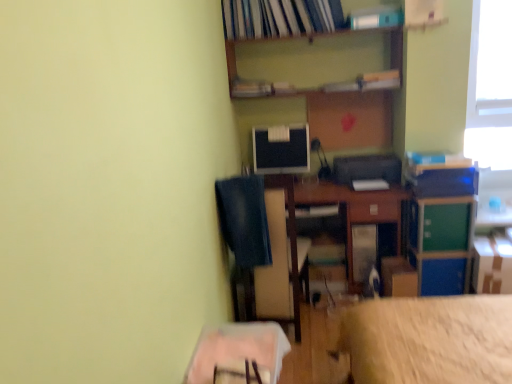
Question: Is white plastic book at upper center, which appears as the second book when ordered from the bottom, located outside wooden table at lower center, which is the 2th table in right-to-left order?

Choices:
 (A) yes
 (B) no

Answer: (A)

Question: From a real-world perspective, is white plastic book at upper center, marked as the second book in a top-to-bottom arrangement, located higher than wooden table at lower center, arranged as the first table when viewed from the front?

Choices:
 (A) no
 (B) yes

Answer: (B)

Question: Is white plastic book at upper center, marked as the second book in a top-to-bottom arrangement, wider than wooden table at lower center, which is the second table in back-to-front order?

Choices:
 (A) no
 (B) yes

Answer: (A)

Question: Considering the relative sizes of white plastic book at upper center, marked as the second book in a top-to-bottom arrangement, and wooden table at lower center, which is the 2th table in right-to-left order, in the image provided, is white plastic book at upper center, marked as the second book in a top-to-bottom arrangement, bigger than wooden table at lower center, which is the 2th table in right-to-left order,?

Choices:
 (A) yes
 (B) no

Answer: (B)

Question: Is white plastic book at upper center, which appears as the second book when ordered from the bottom, at the right side of wooden table at lower center, which is the second table in back-to-front order?

Choices:
 (A) no
 (B) yes

Answer: (B)

Question: Is white plastic book at upper center, which appears as the second book when ordered from the bottom, in front of or behind green plastic file cabinet at right in the image?

Choices:
 (A) behind
 (B) front

Answer: (A)

Question: From the image's perspective, relative to green plastic file cabinet at right, is white plastic book at upper center, which appears as the second book when ordered from the bottom, above or below?

Choices:
 (A) above
 (B) below

Answer: (A)

Question: Considering the relative positions of white plastic book at upper center, which appears as the second book when ordered from the bottom, and green plastic file cabinet at right in the image provided, is white plastic book at upper center, which appears as the second book when ordered from the bottom, to the left or to the right of green plastic file cabinet at right?

Choices:
 (A) right
 (B) left

Answer: (B)

Question: In terms of height, does white plastic book at upper center, which appears as the second book when ordered from the bottom, look taller or shorter compared to green plastic file cabinet at right?

Choices:
 (A) short
 (B) tall

Answer: (A)

Question: Does point (271, 139) appear closer or farther from the camera than point (280, 92)?

Choices:
 (A) closer
 (B) farther

Answer: (B)

Question: From the image's perspective, is matte black monitor at center above or below matte plastic book at upper center, which appears as the third book when viewed from the top?

Choices:
 (A) below
 (B) above

Answer: (A)

Question: Considering the positions of matte black monitor at center and matte plastic book at upper center, which appears as the third book when viewed from the top, in the image, is matte black monitor at center bigger or smaller than matte plastic book at upper center, which appears as the third book when viewed from the top,?

Choices:
 (A) small
 (B) big

Answer: (B)

Question: Looking at their shapes, would you say matte black monitor at center is wider or thinner than matte plastic book at upper center, which appears as the third book when viewed from the top?

Choices:
 (A) wide
 (B) thin

Answer: (B)

Question: From a real-world perspective, is white plastic book at upper center, which appears as the second book when ordered from the bottom, physically located above or below cardboard box at lower right, positioned as the 2th cardboard box in left-to-right order?

Choices:
 (A) above
 (B) below

Answer: (A)

Question: Is point (362, 24) closer or farther from the camera than point (507, 284)?

Choices:
 (A) closer
 (B) farther

Answer: (B)